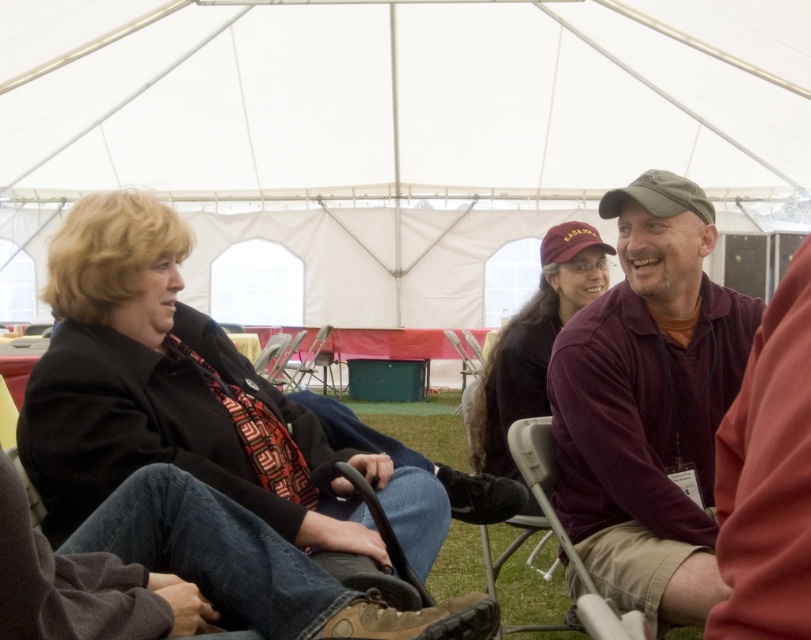
Question: Is matte black jacket at center to the right of maroon jersey at center from the viewer's perspective?

Choices:
 (A) yes
 (B) no

Answer: (B)

Question: Does matte black jacket at center appear on the right side of maroon jersey at center?

Choices:
 (A) no
 (B) yes

Answer: (A)

Question: Which of the following is the farthest from the observer?

Choices:
 (A) matte black jacket at center
 (B) maroon jersey at center

Answer: (A)

Question: Is matte black jacket at center to the right of maroon jersey at center from the viewer's perspective?

Choices:
 (A) yes
 (B) no

Answer: (B)

Question: Which of the following is the closest to the observer?

Choices:
 (A) (608, 323)
 (B) (344, 486)

Answer: (B)